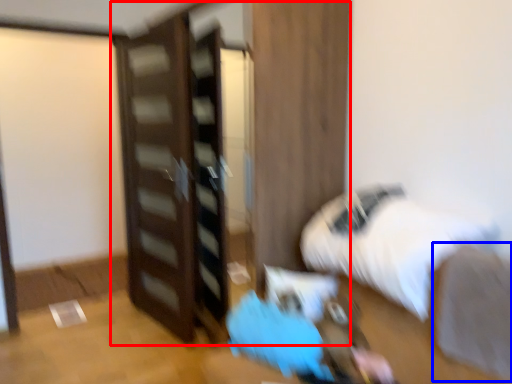
Question: Which of the following is the farthest to the observer, dresser (highlighted by a red box) or sheet (highlighted by a blue box)?

Choices:
 (A) dresser
 (B) sheet

Answer: (A)